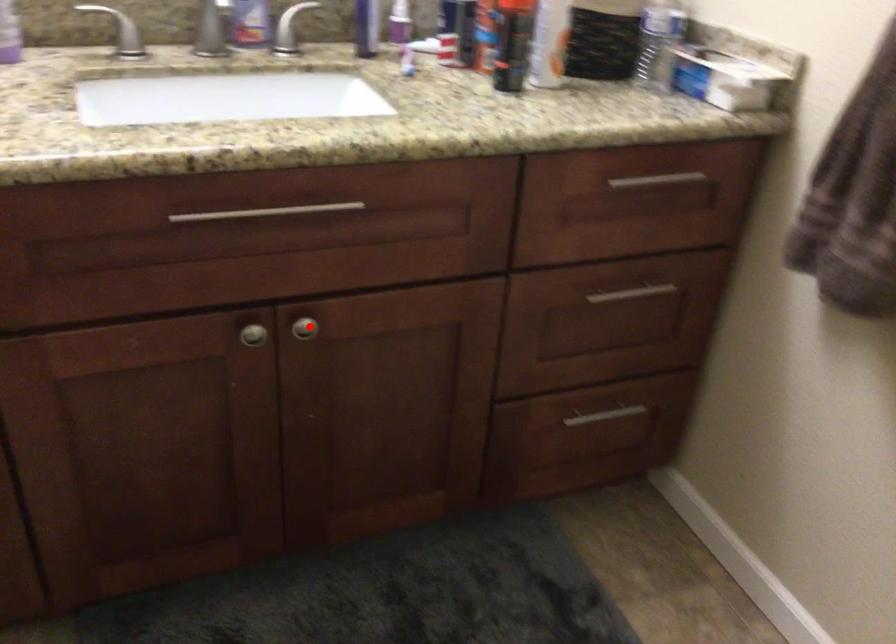
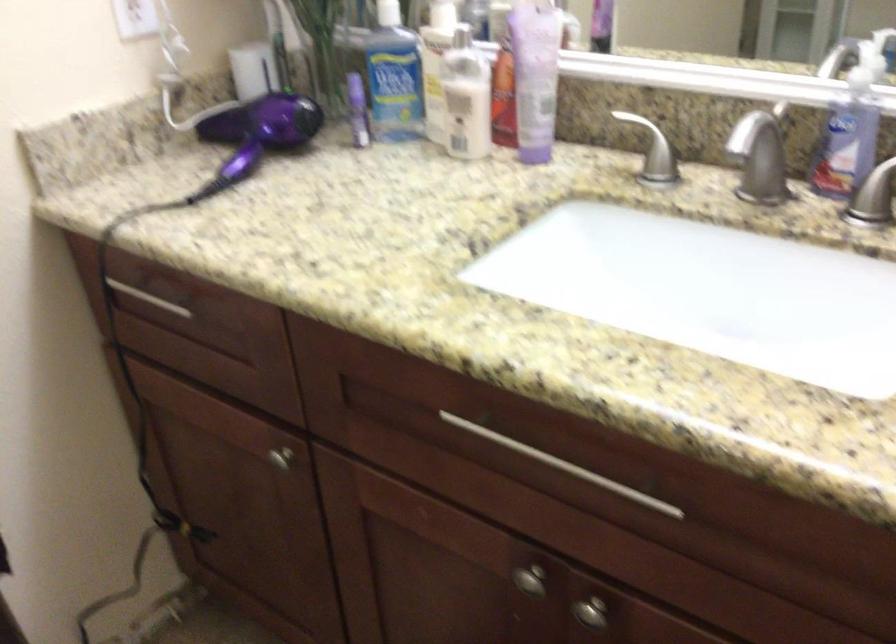
Question: A red point is marked in image1. In image2, is the corresponding 3D point closer to the camera or farther? Reply with the corresponding letter.

Choices:
 (A) The corresponding 3D point is closer.
 (B) The corresponding 3D point is farther.

Answer: (A)